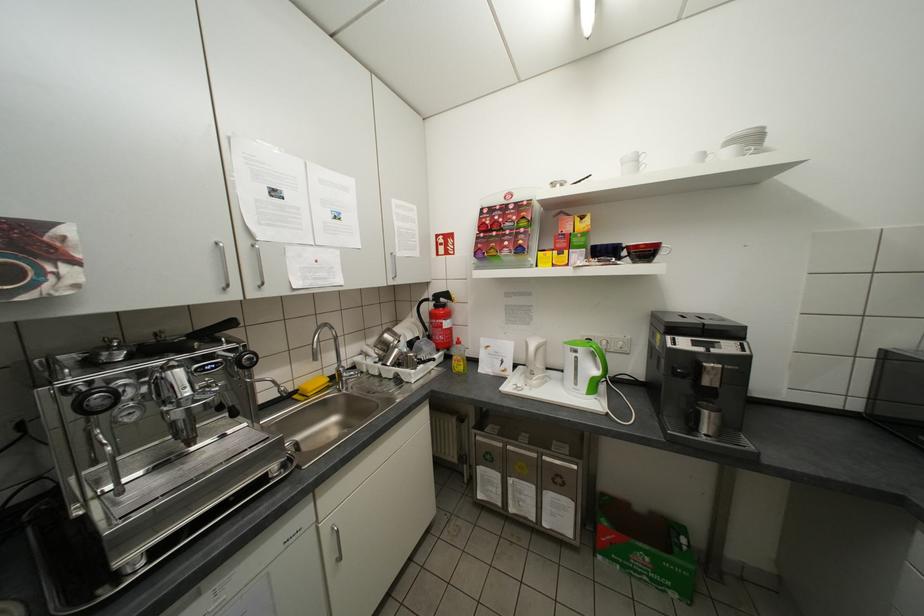
The width and height of the screenshot is (924, 616). Find the location of `recycling bin lid`. recycling bin lid is located at coordinates (642, 528).